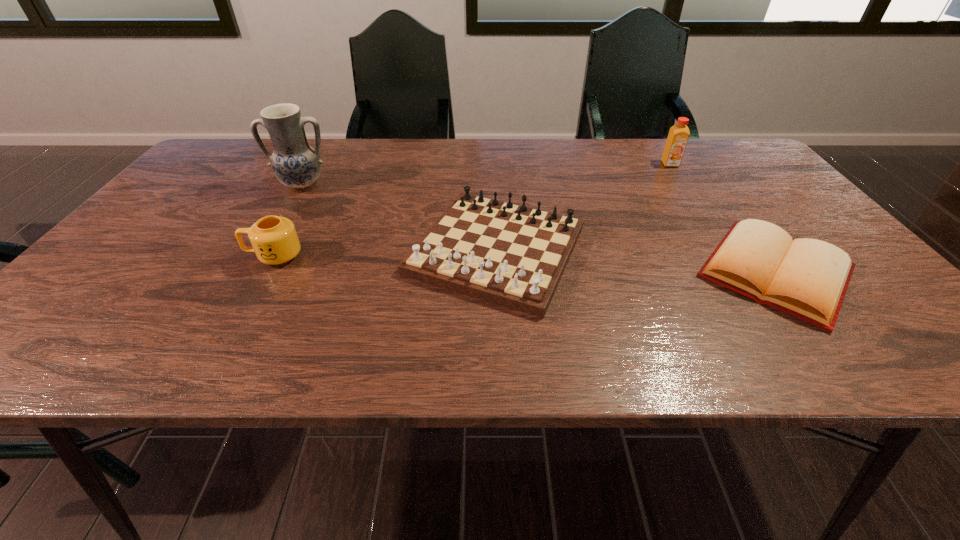
I want to click on the tallest object, so click(295, 163).

Where is `pottery`? Image resolution: width=960 pixels, height=540 pixels. pottery is located at coordinates (295, 163).

Where is `the farthest object`? The height and width of the screenshot is (540, 960). the farthest object is located at coordinates (678, 136).

Locate an element on the screen. This screenshot has width=960, height=540. the second tallest object is located at coordinates (678, 136).

Locate an element on the screen. mug is located at coordinates (274, 239).

Find the location of a particular element. Image resolution: width=960 pixels, height=540 pixels. chessboard is located at coordinates (511, 255).

Find the location of a particular element. the third object from left to right is located at coordinates (511, 255).

Find the location of a particular element. Bible is located at coordinates (806, 278).

This screenshot has width=960, height=540. I want to click on free space located 0.240m on the front of the pottery, so click(x=264, y=253).

The width and height of the screenshot is (960, 540). Find the location of `vacant space located on the front and back of the orange juice`. vacant space located on the front and back of the orange juice is located at coordinates (692, 197).